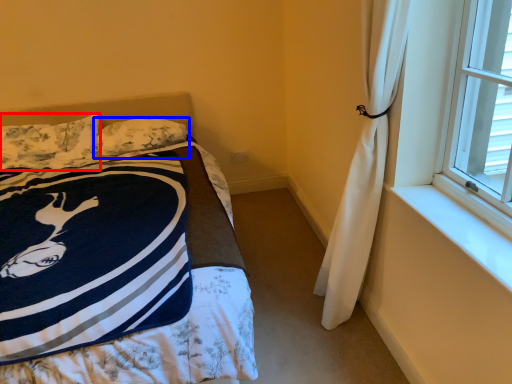
Question: Which object appears farthest to the camera in this image, pillow (highlighted by a red box) or pillow (highlighted by a blue box)?

Choices:
 (A) pillow
 (B) pillow

Answer: (B)